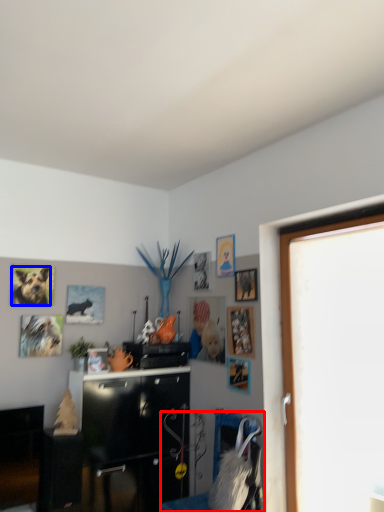
Question: Which of the following is the farthest to the observer, swivel chair (highlighted by a red box) or animal (highlighted by a blue box)?

Choices:
 (A) swivel chair
 (B) animal

Answer: (B)